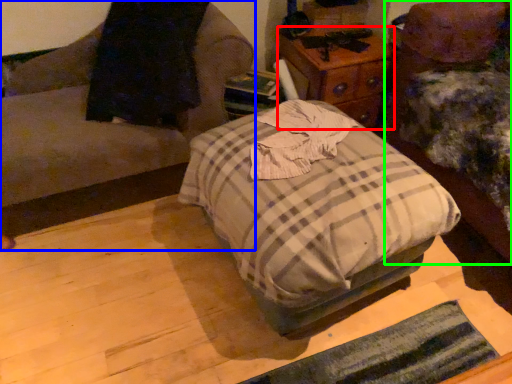
Question: Which is nearer to the nightstand (highlighted by a red box)? furniture (highlighted by a blue box) or furniture (highlighted by a green box).

Choices:
 (A) furniture
 (B) furniture

Answer: (B)